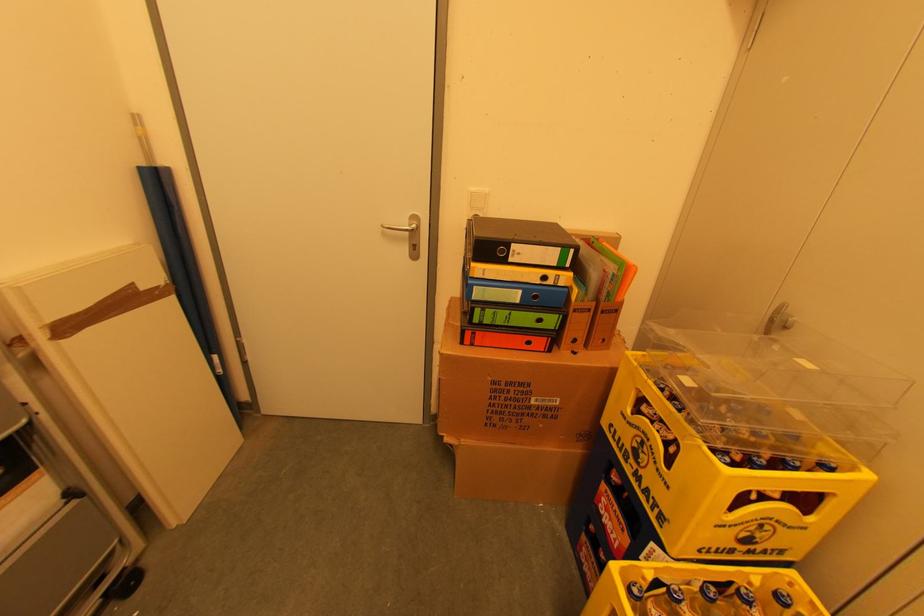
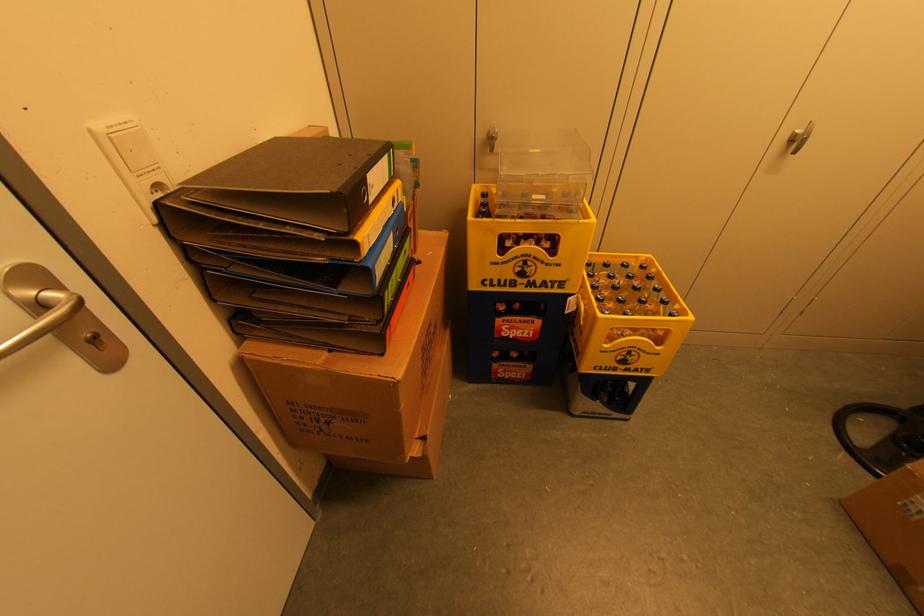
Find the pixel in the second image that matches (645,456) in the first image.

(530, 270)